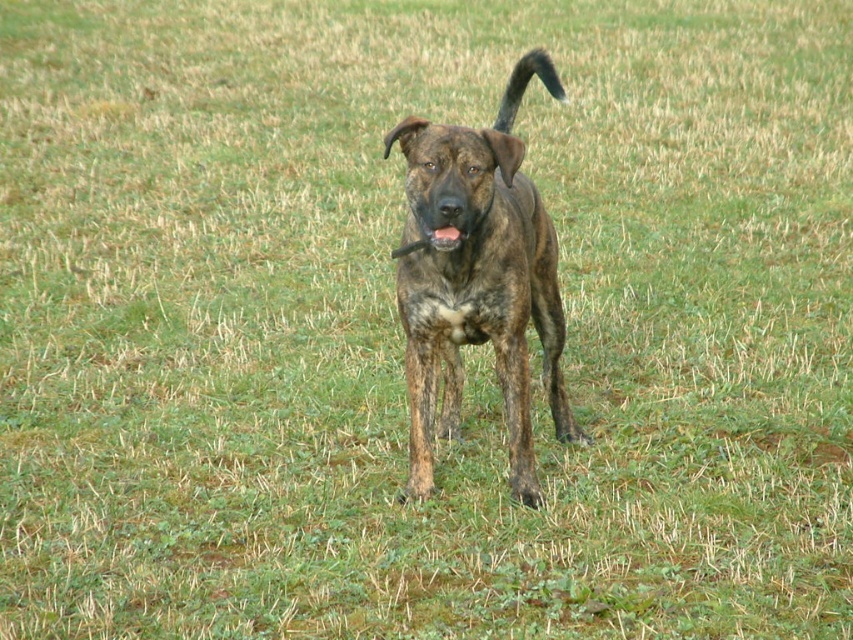
What do you see at coordinates (479, 276) in the screenshot? I see `brindle fur dog at center` at bounding box center [479, 276].

Which is behind, point (514, 179) or point (445, 227)?

The point (514, 179) is behind.

Identify the location of brindle fur dog at center. (479, 276).

Is point (509, 120) farther from viewer compared to point (450, 234)?

Yes, point (509, 120) is farther from viewer.

Is brown brindle tail at upper right closer to camera compared to brown brindle dog at center?

No.

Is point (498, 115) farther from camera compared to point (440, 232)?

Yes, point (498, 115) is behind point (440, 232).

The height and width of the screenshot is (640, 853). What are the coordinates of `brown brindle tail at upper right` in the screenshot? It's located at (525, 84).

Does brindle fur dog at center have a greater width compared to brown brindle tail at upper right?

No.

You are a GUI agent. You are given a task and a screenshot of the screen. Output one action in this format:
    pyautogui.click(x=<x>, y=<y>)
    Task: Click on the brindle fur dog at center
    The width and height of the screenshot is (853, 640).
    Given the screenshot: What is the action you would take?
    pyautogui.click(x=479, y=276)

Find the location of a particular element. The width and height of the screenshot is (853, 640). brindle fur dog at center is located at coordinates (479, 276).